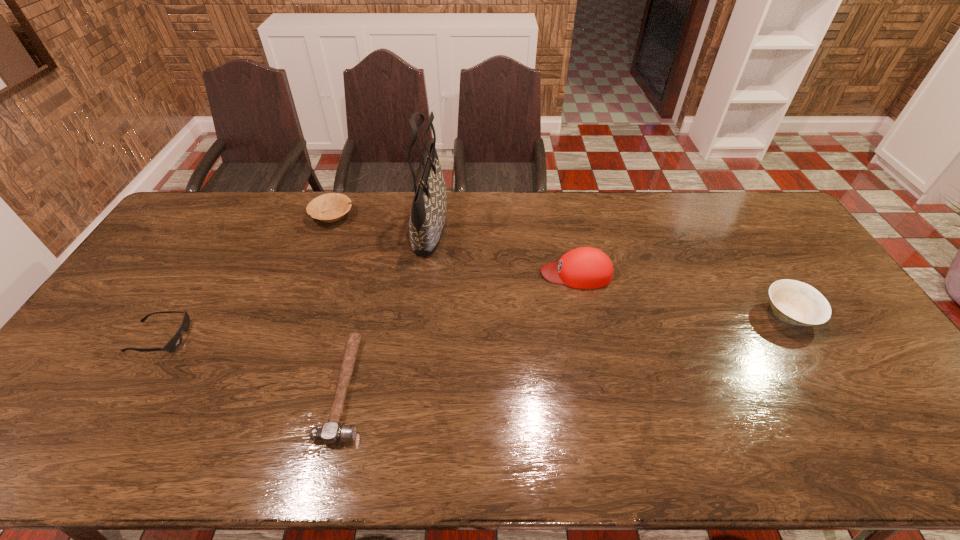
The width and height of the screenshot is (960, 540). In order to click on blank region between the baseball cap and the fourth shortest object in this screenshot , I will do `click(683, 294)`.

Locate an element on the screen. This screenshot has height=540, width=960. blank region between the leftmost object and the baseball cap is located at coordinates (368, 305).

The height and width of the screenshot is (540, 960). In order to click on free space between the nearer bowl and the fifth shortest object in this screenshot , I will do `click(683, 294)`.

Where is `free area in between the second tallest object and the fourth object from left to right`? free area in between the second tallest object and the fourth object from left to right is located at coordinates (503, 249).

Where is `empty space between the nearer bowl and the fifth shortest object`? This screenshot has width=960, height=540. empty space between the nearer bowl and the fifth shortest object is located at coordinates (683, 294).

At what (x,y) coordinates should I click in order to perform the action: click on free space between the fifth shortest object and the third tallest object. Please return your answer as a coordinate pair (x, y). The image size is (960, 540). Looking at the image, I should click on (683, 294).

Locate an element on the screen. This screenshot has width=960, height=540. unoccupied area between the third shortest object and the fourth object from right to left is located at coordinates (339, 302).

The image size is (960, 540). What are the coordinates of `vacant area between the sunglasses and the second tallest object` in the screenshot? It's located at (368, 305).

Locate an element on the screen. vacant space in between the second object from right to left and the shorter bowl is located at coordinates (454, 245).

Identify which object is located as the fifth nearest to the sunglasses. Please provide its 2D coordinates. Your answer should be formatted as a tuple, i.e. [(x, y)], where the tuple contains the x and y coordinates of a point satisfying the conditions above.

[(794, 302)]